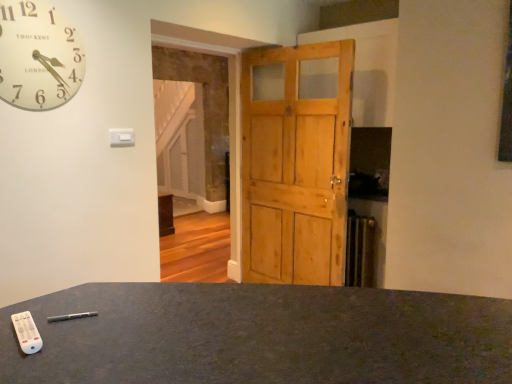
Question: Can you confirm if matte black desk at lower center is smaller than natural wood barn door at center?

Choices:
 (A) yes
 (B) no

Answer: (B)

Question: Does matte black desk at lower center have a greater width compared to natural wood barn door at center?

Choices:
 (A) yes
 (B) no

Answer: (A)

Question: From the image's perspective, is matte black desk at lower center above natural wood barn door at center?

Choices:
 (A) yes
 (B) no

Answer: (B)

Question: From a real-world perspective, is matte black desk at lower center physically below natural wood barn door at center?

Choices:
 (A) no
 (B) yes

Answer: (B)

Question: Considering the relative sizes of matte black desk at lower center and natural wood barn door at center in the image provided, is matte black desk at lower center taller than natural wood barn door at center?

Choices:
 (A) no
 (B) yes

Answer: (A)

Question: Looking at their shapes, would you say white wooden clock at upper left is wider or thinner than natural wood barn door at center?

Choices:
 (A) wide
 (B) thin

Answer: (B)

Question: Is white wooden clock at upper left to the left or to the right of natural wood barn door at center in the image?

Choices:
 (A) left
 (B) right

Answer: (A)

Question: From a real-world perspective, is white wooden clock at upper left physically located above or below natural wood barn door at center?

Choices:
 (A) below
 (B) above

Answer: (B)

Question: From the image's perspective, relative to natural wood barn door at center, is white wooden clock at upper left above or below?

Choices:
 (A) above
 (B) below

Answer: (A)

Question: From a real-world perspective, is natural wood barn door at center above or below white wooden clock at upper left?

Choices:
 (A) above
 (B) below

Answer: (B)

Question: Choose the correct answer: Is natural wood barn door at center inside white wooden clock at upper left or outside it?

Choices:
 (A) inside
 (B) outside

Answer: (B)

Question: In terms of width, does natural wood barn door at center look wider or thinner when compared to white wooden clock at upper left?

Choices:
 (A) wide
 (B) thin

Answer: (A)

Question: Visually, is natural wood barn door at center positioned to the left or to the right of white wooden clock at upper left?

Choices:
 (A) right
 (B) left

Answer: (A)

Question: Is point (185, 377) positioned closer to the camera than point (31, 105)?

Choices:
 (A) farther
 (B) closer

Answer: (B)

Question: Looking at their shapes, would you say matte black desk at lower center is wider or thinner than white wooden clock at upper left?

Choices:
 (A) thin
 (B) wide

Answer: (B)